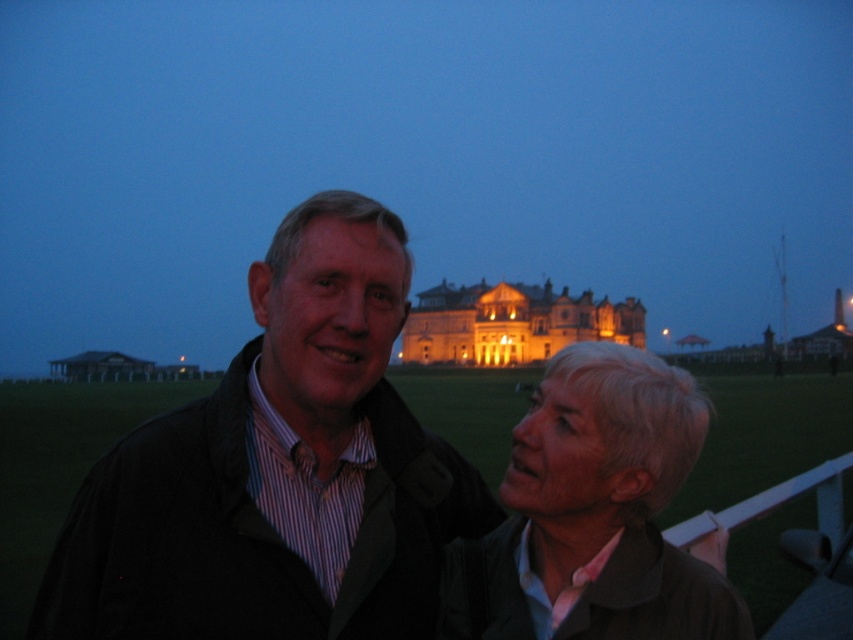
Does matte brown jacket at center have a lesser height compared to golden illuminated building at center?

No, matte brown jacket at center is not shorter than golden illuminated building at center.

This screenshot has width=853, height=640. What do you see at coordinates (593, 515) in the screenshot?
I see `matte brown jacket at center` at bounding box center [593, 515].

The image size is (853, 640). In order to click on matte brown jacket at center in this screenshot , I will do `click(593, 515)`.

Between matte black jacket at center and matte brown jacket at center, which one appears on the left side from the viewer's perspective?

From the viewer's perspective, matte black jacket at center appears more on the left side.

Is point (445, 493) farther from camera compared to point (737, 595)?

Yes, it is.

Where is `matte black jacket at center`? matte black jacket at center is located at coordinates (277, 472).

Is matte black jacket at center closer to the viewer compared to golden illuminated building at center?

Result: Yes.

Measure the distance between point (77, 528) and camera.

A distance of 88.45 meters exists between point (77, 528) and camera.

Find the location of a particular element. matte black jacket at center is located at coordinates (277, 472).